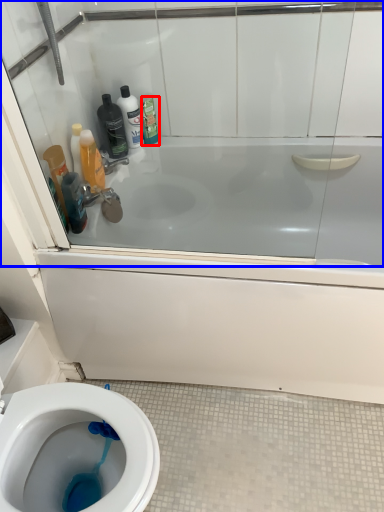
Question: Which of the following is the closest to the observer, cleaning product (highlighted by a red box) or glass door (highlighted by a blue box)?

Choices:
 (A) cleaning product
 (B) glass door

Answer: (B)